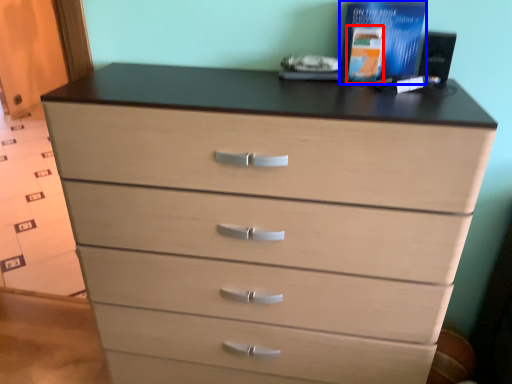
Question: Among these objects, which one is farthest to the camera, book (highlighted by a red box) or book (highlighted by a blue box)?

Choices:
 (A) book
 (B) book

Answer: (A)